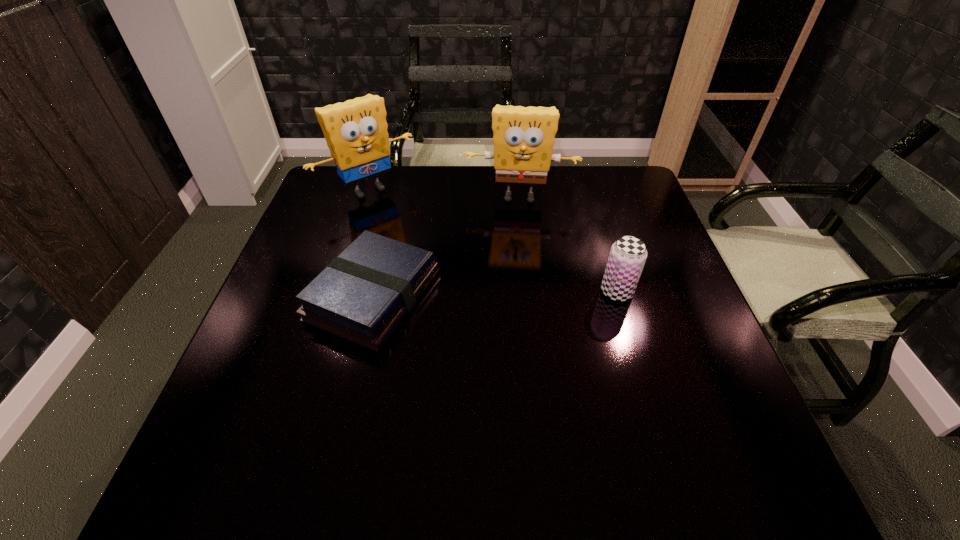
Locate an element on the screen. the shortest object is located at coordinates (363, 294).

Where is `the second shortest object`? The width and height of the screenshot is (960, 540). the second shortest object is located at coordinates (628, 254).

Identify the location of the rightmost object. The width and height of the screenshot is (960, 540). (628, 254).

Where is `the left sponge`? The image size is (960, 540). the left sponge is located at coordinates (356, 133).

I want to click on the second object from right to left, so click(523, 137).

Where is `free space located 0.070m on the left of the shortest object`? free space located 0.070m on the left of the shortest object is located at coordinates (279, 295).

Identify the location of vacant space situated 0.320m on the left of the third tallest object. (465, 292).

Find the location of a particular element. The width and height of the screenshot is (960, 540). free point located on the face of the left sponge is located at coordinates (462, 281).

This screenshot has height=540, width=960. In order to click on vacant position located 0.370m on the face of the left sponge in this screenshot , I will do `click(462, 281)`.

This screenshot has height=540, width=960. Identify the location of free point located 0.230m on the face of the left sponge. (432, 249).